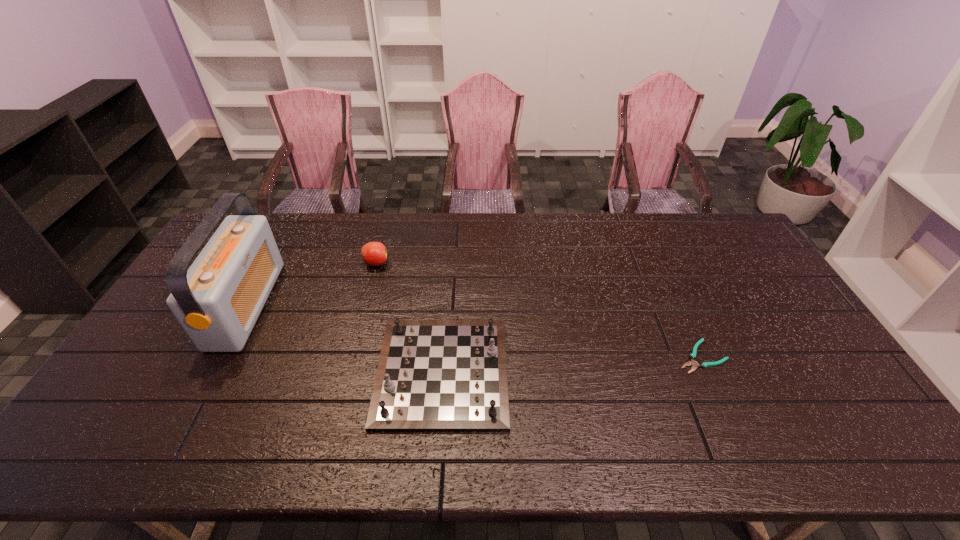
Locate an element on the screen. The height and width of the screenshot is (540, 960). vacant space in between the leftmost object and the third object from right to left is located at coordinates pos(311,284).

Locate an element on the screen. The width and height of the screenshot is (960, 540). vacant area that lies between the shortest object and the second object from left to right is located at coordinates (539, 310).

This screenshot has height=540, width=960. In order to click on free space between the second object from right to left and the apple in this screenshot , I will do `click(409, 318)`.

This screenshot has height=540, width=960. What are the coordinates of `free space between the apple and the tallest object` in the screenshot? It's located at (311, 284).

Locate which object is the closest to the tallest object. Please provide its 2D coordinates. Your answer should be formatted as a tuple, i.e. [(x, y)], where the tuple contains the x and y coordinates of a point satisfying the conditions above.

[(374, 253)]

Where is `object that is the second closest to the shortest object`? The height and width of the screenshot is (540, 960). object that is the second closest to the shortest object is located at coordinates (374, 253).

Where is `free space that satisfies the following two spatial constraints: 1. on the front side of the apple; 2. on the front-facing side of the tallest object`? This screenshot has width=960, height=540. free space that satisfies the following two spatial constraints: 1. on the front side of the apple; 2. on the front-facing side of the tallest object is located at coordinates (365, 305).

The height and width of the screenshot is (540, 960). What are the coordinates of `free space that satisfies the following two spatial constraints: 1. on the front side of the apple; 2. on the front-facing side of the tallest object` in the screenshot? It's located at (365, 305).